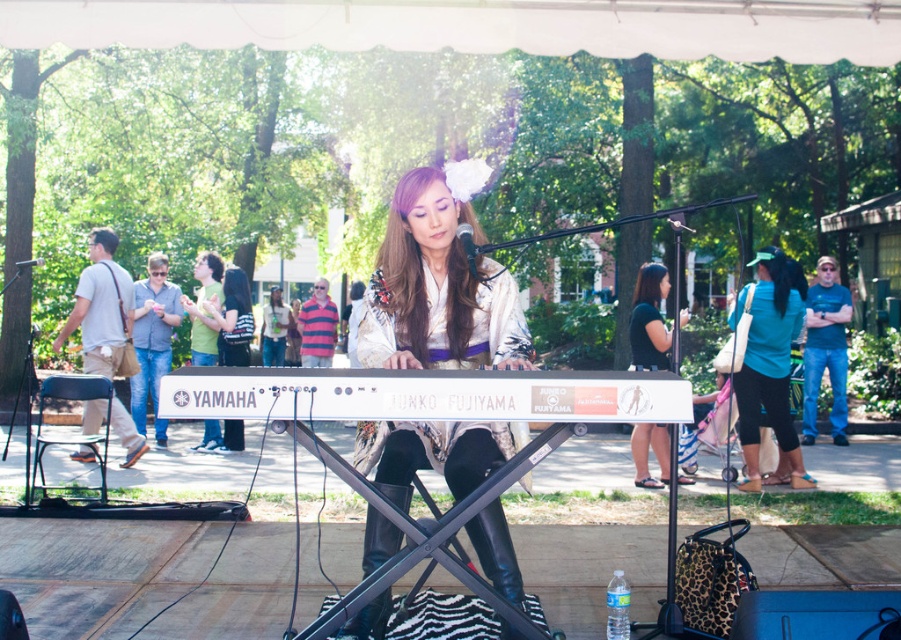
Question: Which of the following is the farthest from the observer?

Choices:
 (A) (235, 305)
 (B) (199, 266)

Answer: (B)

Question: Is white matte keyboard at center above black fabric shirt at center?

Choices:
 (A) no
 (B) yes

Answer: (A)

Question: In this image, where is matte white kimono at center located relative to teal fabric shirt at center?

Choices:
 (A) above
 (B) below

Answer: (B)

Question: Which is nearer to the white matte keyboard at center?

Choices:
 (A) matte white kimono at center
 (B) teal fabric shirt at center
 (C) black fabric shirt at center
 (D) green fabric shirt at upper left

Answer: (A)

Question: Based on their relative distances, which object is nearer to the black fabric shirt at center?

Choices:
 (A) teal fabric shirt at center
 (B) matte black keyboard at center

Answer: (A)

Question: Does matte black keyboard at center have a smaller size compared to green fabric shirt at upper left?

Choices:
 (A) no
 (B) yes

Answer: (B)